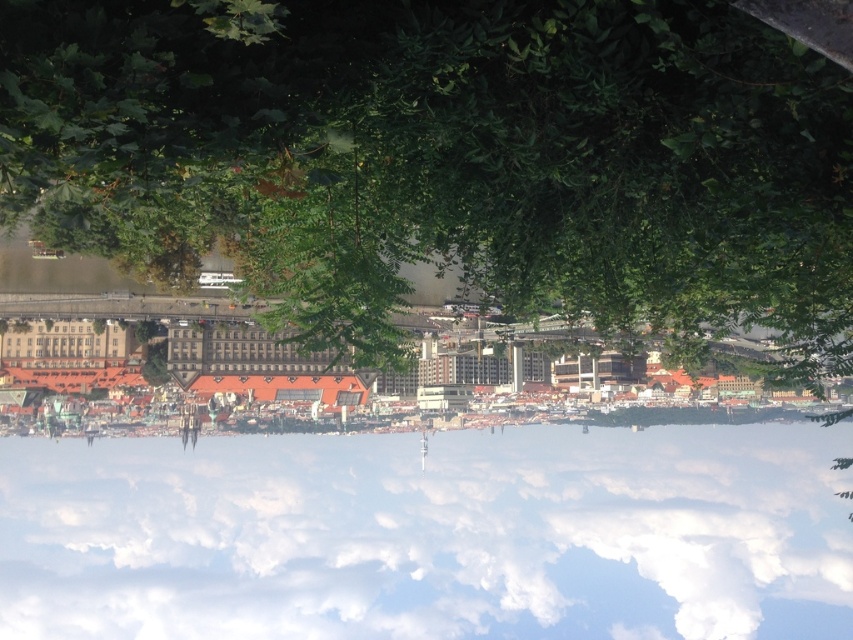
From the picture: Which is more to the left, white fluffy cloud at center or brown stone buildings at center?

Positioned to the left is brown stone buildings at center.

Between white fluffy cloud at center and brown stone buildings at center, which one is positioned higher?

brown stone buildings at center is above.

Which is behind, point (567, 609) or point (247, 371)?

The point (567, 609) is behind.

This screenshot has width=853, height=640. Find the location of `white fluffy cloud at center`. white fluffy cloud at center is located at coordinates (430, 534).